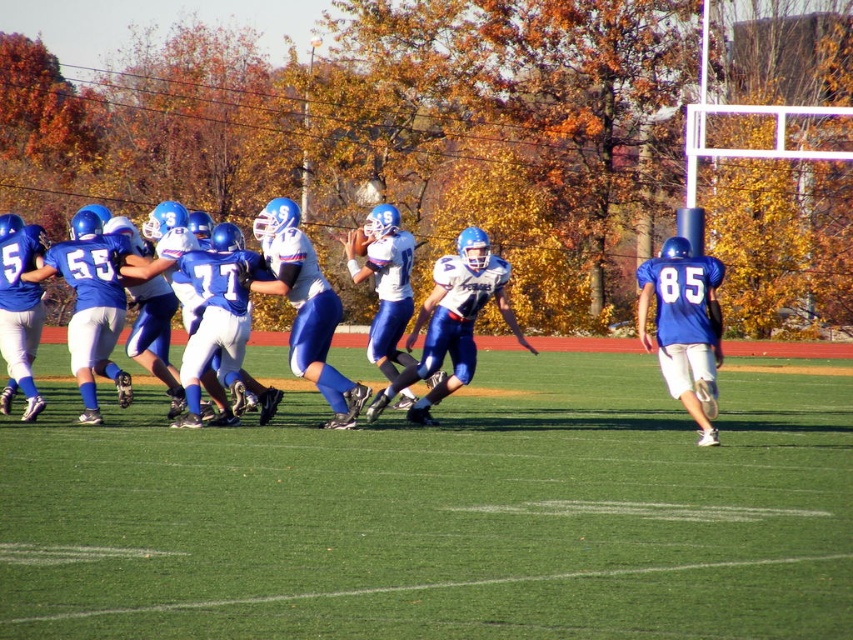
Who is taller, green grass at center or matte blue uniform at center?

matte blue uniform at center is taller.

Does green grass at center have a greater width compared to matte blue uniform at center?

Yes.

You are a GUI agent. You are given a task and a screenshot of the screen. Output one action in this format:
    pyautogui.click(x=<x>, y=<y>)
    Task: Click on the green grass at center
    
    Given the screenshot: What is the action you would take?
    pyautogui.click(x=442, y=513)

I want to click on green grass at center, so click(442, 513).